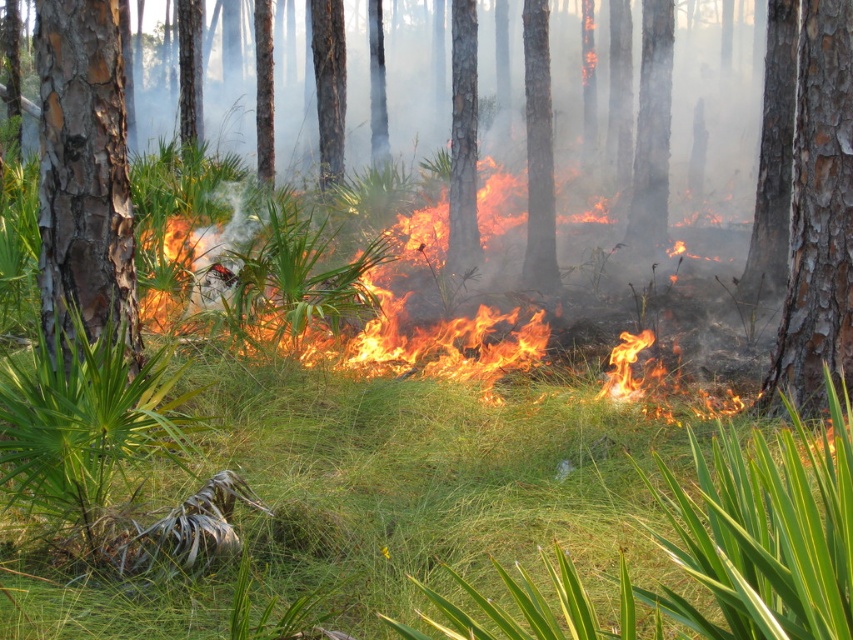
You are a firefighter assessing the fire scene. You notice the green grass at center and the smooth brown bark at left. Which of these two objects is nearer to you?

The green grass at center is closer to the viewer than the smooth brown bark at left, so the green grass at center is nearer.

You are a firefighter trying to assess the fire spread. The fire is at the flaming grass at center. Based on the coordinates provided, can you determine if the fire is closer to the left or right side of the image?

The coordinates of the flaming grass at center are at point (412, 340). Since the x coordinate is 0.533 which is greater than 0.5, the fire is closer to the right side of the image.

You are a firefighter trying to create a firebreak. You see the green grass at center and the smooth brown bark at left. Which one should you prioritize cutting to slow down the fire spread?

The green grass at center should be prioritized because its width surpasses that of the smooth brown bark at left, meaning it can spread fire faster due to its larger surface area.